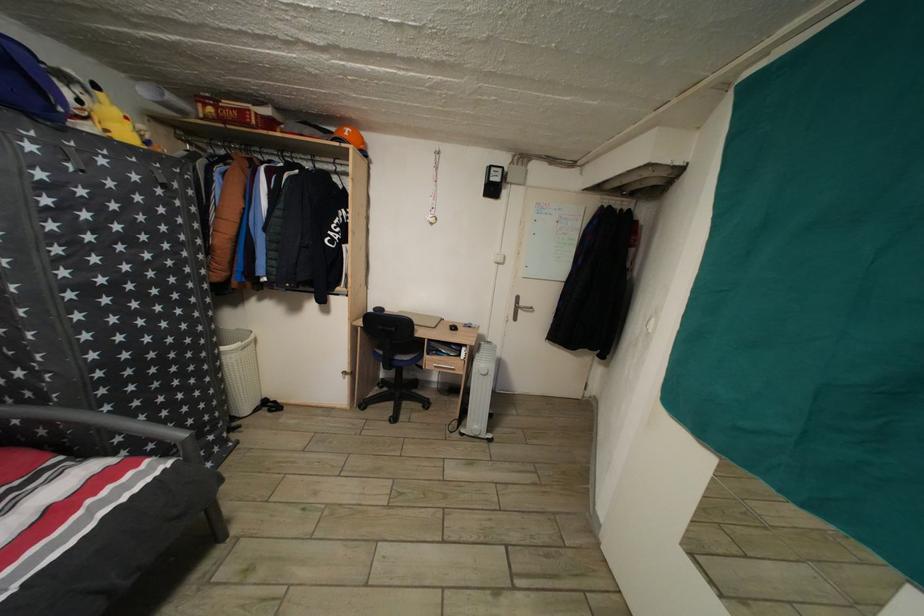
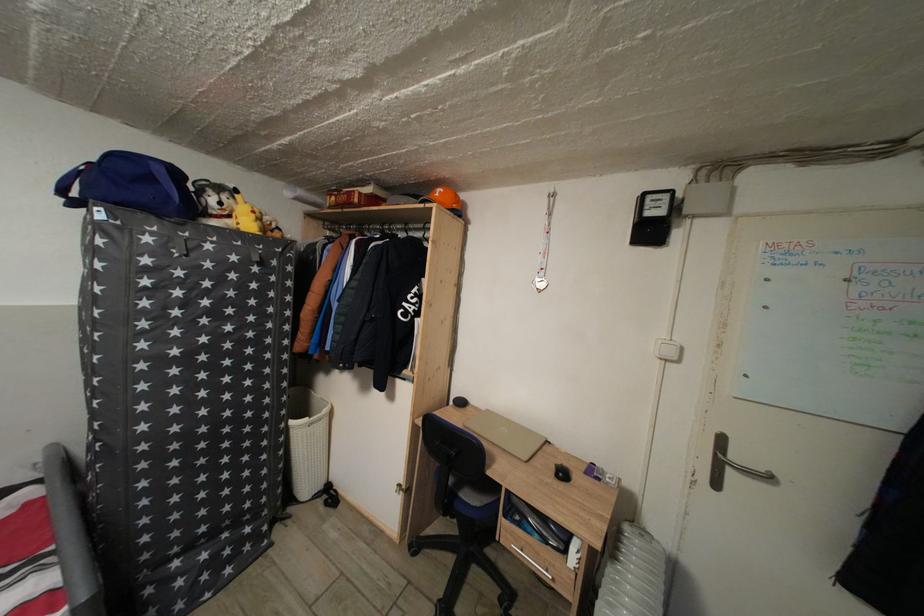
Question: The camera is either moving clockwise (left) or counter-clockwise (right) around the object. The first image is from the beginning of the video and the second image is from the end. Is the camera moving left or right when shooting the video?

Choices:
 (A) Left
 (B) Right

Answer: (B)